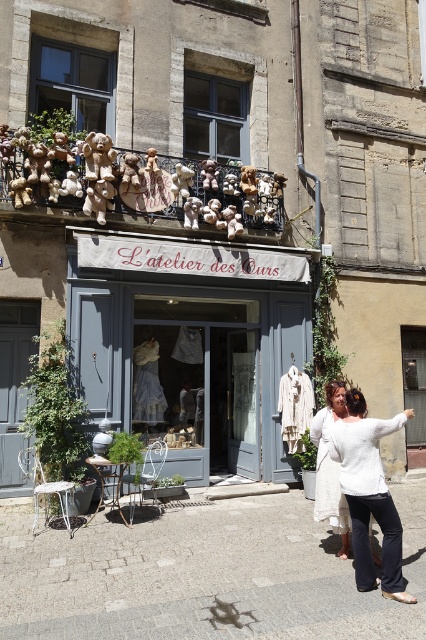
You are a customer standing in front of the storefront and want to reach both the white cotton sweater at center and the white cotton dress at center displayed on the balcony. If your arms can reach up to 60 inches, can you grab both items without moving your position?

The distance between the white cotton sweater at center and the white cotton dress at center is 20.68 inches. Since your arms can reach up to 60 inches, you can easily grab both items without moving your position as the distance between them is well within your reach range.

You are standing in front of the storefront and want to take a photo of the matte gray storefront at center. Where should you position your camera to capture it best?

The matte gray storefront at center is located at point (x=190, y=349), so position your camera at that coordinate to capture it best.

You are a customer looking at the display in the storefront window of L atelier des Ours. You see a white cotton sweater at center and a white cotton dress at center. Which clothing item is located to the right of the other?

The white cotton sweater at center is positioned on the right side of the white cotton dress at center.